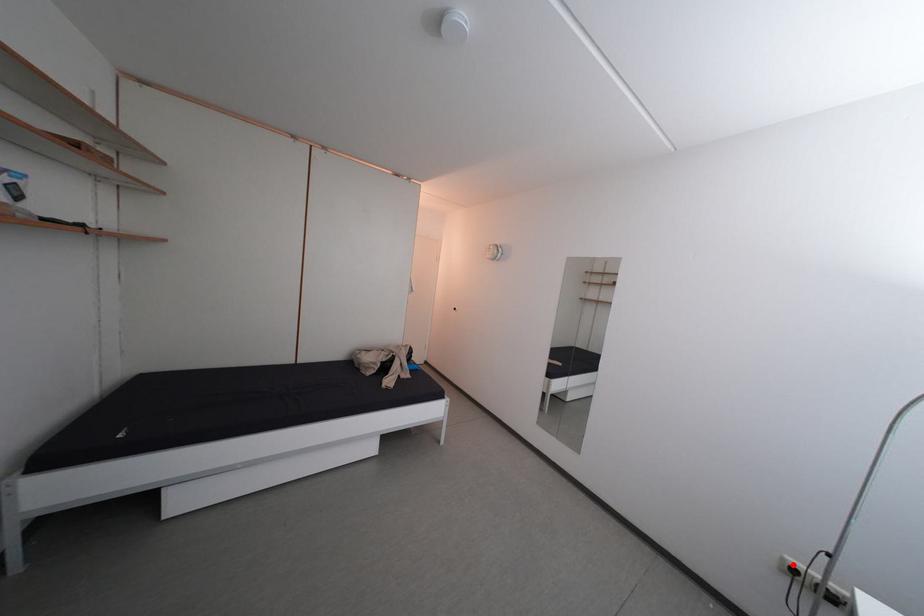
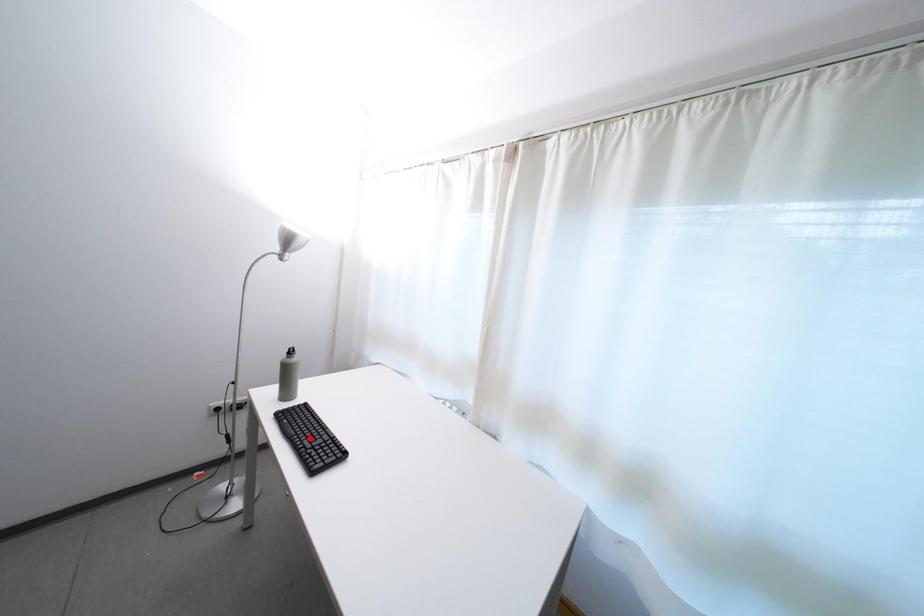
I am providing you with two images of the same scene from different viewpoints. A red point is marked on the first image and another point is marked on the second image. Do the highlighted points in image1 and image2 indicate the same real-world spot?

No